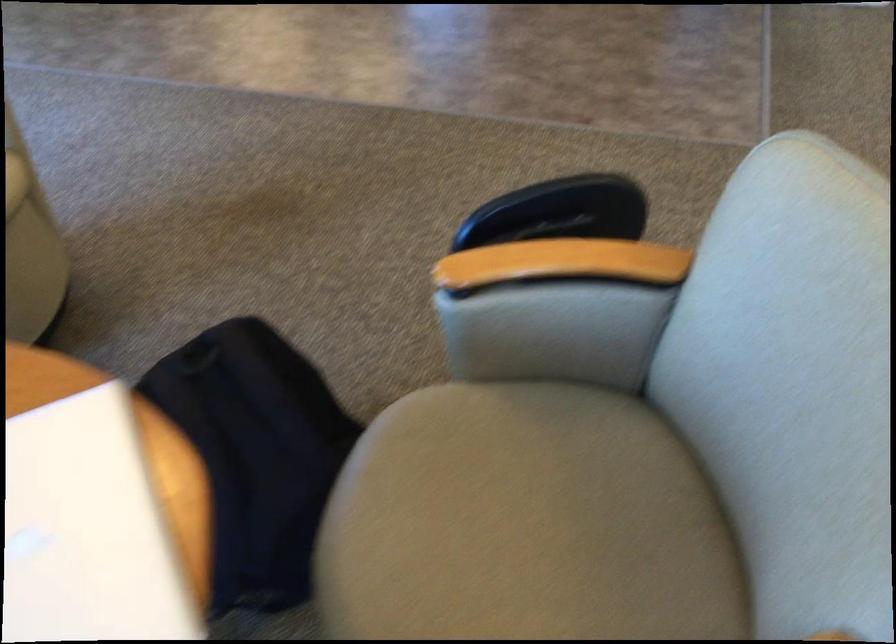
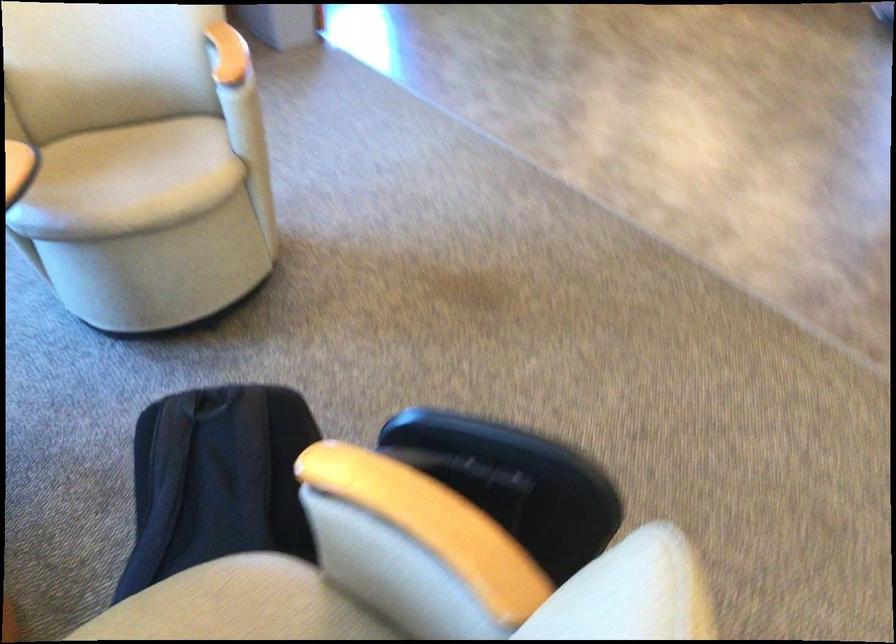
Question: The camera is either moving clockwise (left) or counter-clockwise (right) around the object. The first image is from the beginning of the video and the second image is from the end. Is the camera moving left or right when shooting the video?

Choices:
 (A) Left
 (B) Right

Answer: (B)